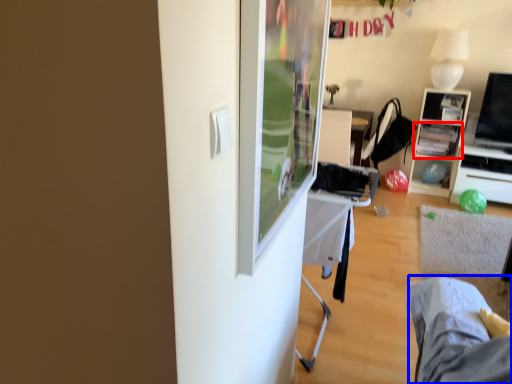
Question: Which object is further to the camera taking this photo, shelf (highlighted by a red box) or bed frame (highlighted by a blue box)?

Choices:
 (A) shelf
 (B) bed frame

Answer: (A)